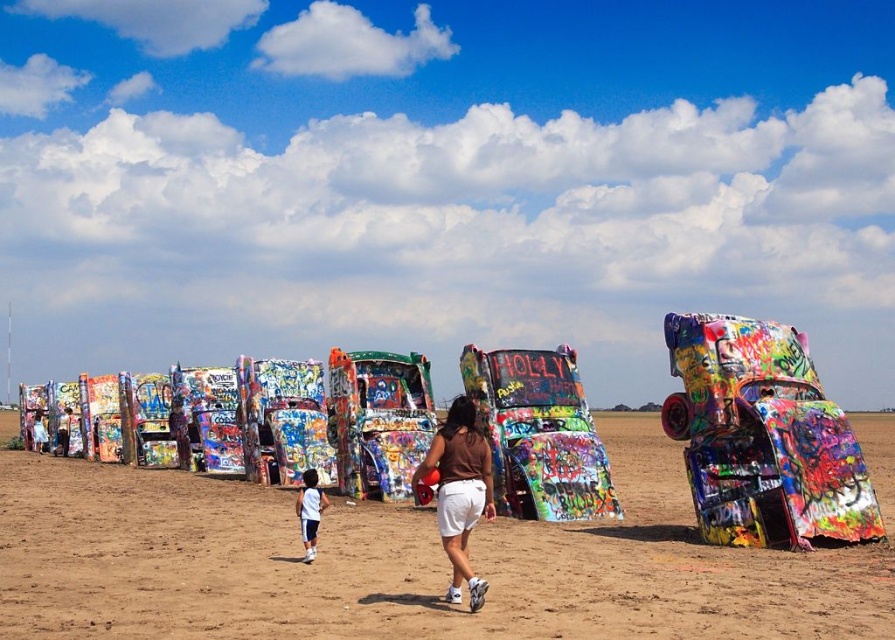
You are an artist planning to paint a desert scene with the brown fabric shorts at center. Based on the provided coordinates, where should you place the brown fabric shorts in your painting?

The brown fabric shorts at center should be placed at coordinates point [459,492] in your painting.

You are an artist planning to install a new sculpture in the desert scene. Given the brown sandy dirt field at center and the brown fabric shorts at center, which object would provide a more stable base for the sculpture and why?

The brown sandy dirt field at center has a larger size compared to brown fabric shorts at center, making it a more stable base for the sculpture due to its greater surface area and structural support.